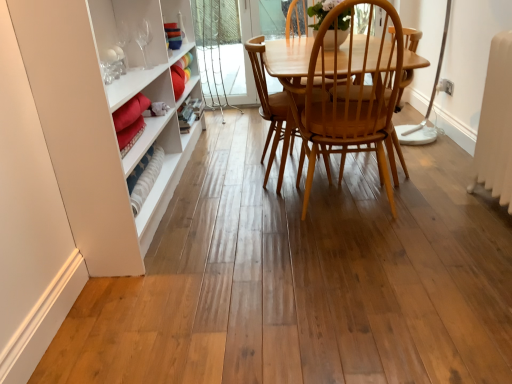
Question: Does light brown wood chair at center have a lesser width compared to light brown wood chair at center?

Choices:
 (A) no
 (B) yes

Answer: (B)

Question: Is light brown wood chair at center at the left side of light brown wood chair at center?

Choices:
 (A) no
 (B) yes

Answer: (B)

Question: Are light brown wood chair at center and light brown wood chair at center located far from each other?

Choices:
 (A) yes
 (B) no

Answer: (B)

Question: Can you confirm if light brown wood chair at center is positioned to the right of light brown wood chair at center?

Choices:
 (A) yes
 (B) no

Answer: (B)

Question: Is light brown wood chair at center positioned in front of light brown wood chair at center?

Choices:
 (A) yes
 (B) no

Answer: (B)

Question: Can light brown wood chair at center be found inside light brown wood chair at center?

Choices:
 (A) no
 (B) yes

Answer: (A)

Question: Can you confirm if light brown wood chair at center is smaller than light brown wood chair at center?

Choices:
 (A) yes
 (B) no

Answer: (B)

Question: Is light brown wood chair at center surrounded by light brown wood chair at center?

Choices:
 (A) no
 (B) yes

Answer: (A)

Question: From a real-world perspective, is light brown wood chair at center positioned over light brown wood chair at center based on gravity?

Choices:
 (A) yes
 (B) no

Answer: (A)

Question: Could you tell me if light brown wood chair at center is turned towards light brown wood chair at center?

Choices:
 (A) yes
 (B) no

Answer: (A)

Question: Does light brown wood chair at center come behind light brown wood chair at center?

Choices:
 (A) no
 (B) yes

Answer: (A)

Question: Is light brown wood chair at center beside light brown wood chair at center?

Choices:
 (A) yes
 (B) no

Answer: (B)

Question: In the image, is light brown wood chair at center on the left side or the right side of light brown wood chair at center?

Choices:
 (A) right
 (B) left

Answer: (A)